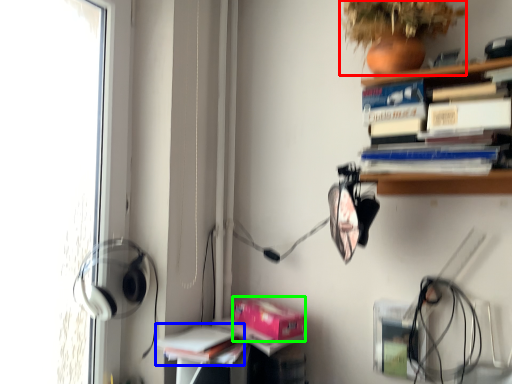
Question: Based on their relative distances, which object is nearer to plant (highlighted by a red box)? Choose from book (highlighted by a blue box) and paperback book (highlighted by a green box).

Choices:
 (A) book
 (B) paperback book

Answer: (B)